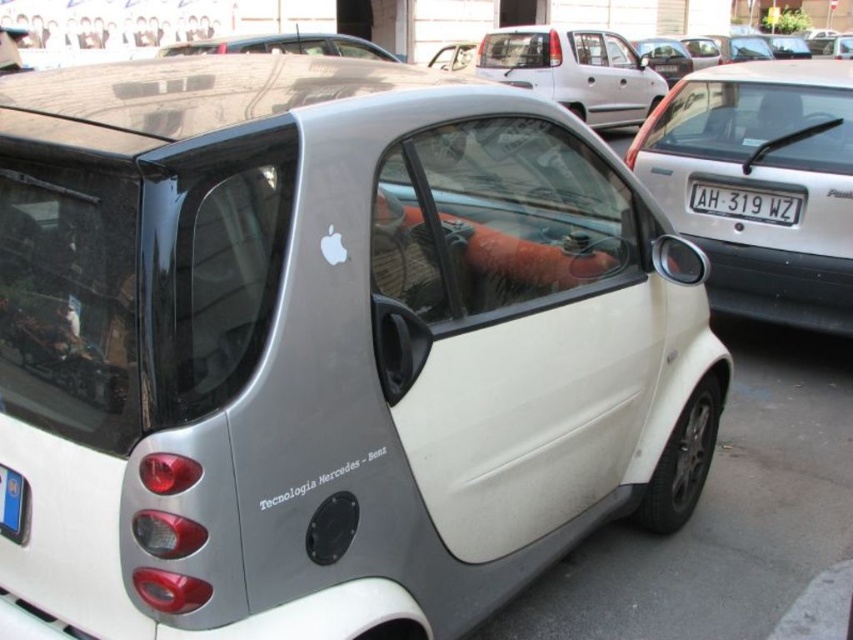
This screenshot has height=640, width=853. What do you see at coordinates (759, 184) in the screenshot?
I see `silver metallic car at center` at bounding box center [759, 184].

Is silver metallic car at center further to the viewer compared to white matte car at center?

No, silver metallic car at center is in front of white matte car at center.

This screenshot has height=640, width=853. What are the coordinates of `silver metallic car at center` in the screenshot? It's located at (759, 184).

Locate an element on the screen. The height and width of the screenshot is (640, 853). silver metallic car at center is located at coordinates (759, 184).

Between point (223, 38) and point (753, 198), which one is positioned in front?

Point (753, 198) is more forward.

Looking at this image, between silver metallic car at upper center and white plastic license plate at center, which one appears on the left side from the viewer's perspective?

silver metallic car at upper center is more to the left.

Between point (170, 51) and point (709, 188), which one is positioned in front?

Point (709, 188)

Where is `silver metallic car at upper center`? silver metallic car at upper center is located at coordinates (283, 45).

Which is in front, point (579, 45) or point (759, 212)?

Point (759, 212) is more forward.

Image resolution: width=853 pixels, height=640 pixels. What are the coordinates of `white matte car at center` in the screenshot? It's located at (573, 70).